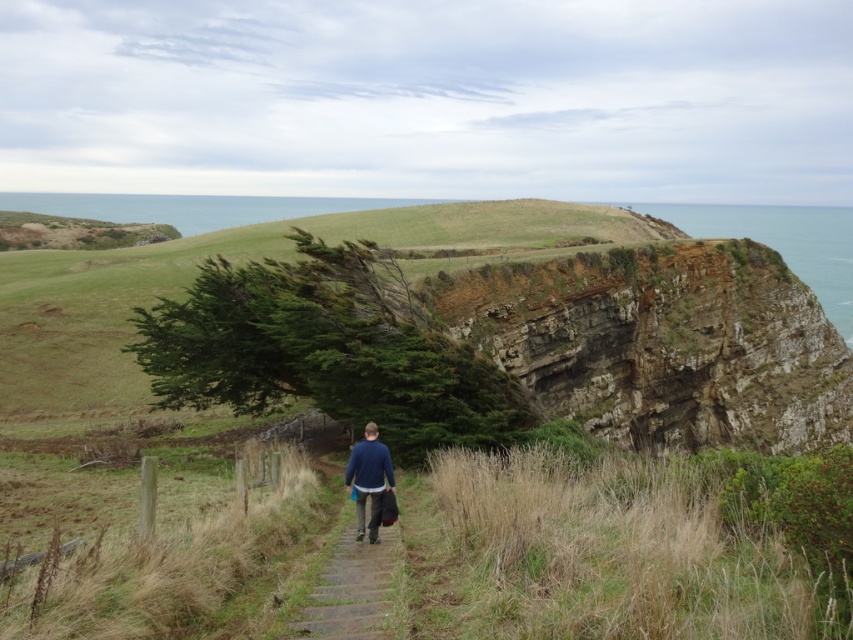
Question: Which object is the closest to the blue cotton sweater at center?

Choices:
 (A) rugged stone cliff at upper right
 (B) brown wooden path at center
 (C) green grassy hillside at center

Answer: (B)

Question: Does green grassy hillside at center have a larger size compared to blue cotton sweater at center?

Choices:
 (A) yes
 (B) no

Answer: (A)

Question: Does brown wooden path at center have a larger size compared to blue cotton sweater at center?

Choices:
 (A) yes
 (B) no

Answer: (B)

Question: Is the position of green grassy hillside at center more distant than that of dry grass at lower right?

Choices:
 (A) no
 (B) yes

Answer: (B)

Question: Which point is closer to the camera taking this photo?

Choices:
 (A) (347, 465)
 (B) (705, 330)

Answer: (A)

Question: Which point is farther to the camera?

Choices:
 (A) rugged stone cliff at upper right
 (B) brown wooden path at center
 (C) dry grass at lower right
 (D) green grassy hillside at center

Answer: (A)